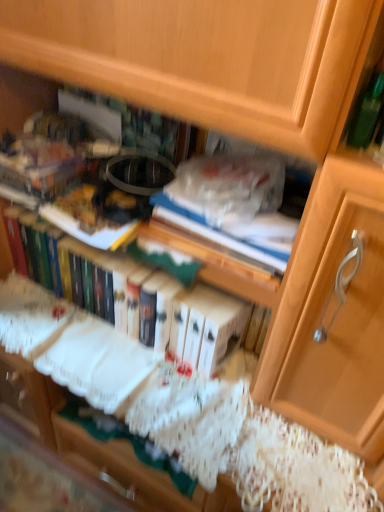
Question: From the image's perspective, is hardcover book at center positioned above or below blue hardcover book at center?

Choices:
 (A) above
 (B) below

Answer: (B)

Question: Is hardcover book at center spatially inside blue hardcover book at center, or outside of it?

Choices:
 (A) inside
 (B) outside

Answer: (B)

Question: Is hardcover book at center to the left or to the right of blue hardcover book at center in the image?

Choices:
 (A) right
 (B) left

Answer: (B)

Question: In terms of width, does blue hardcover book at center look wider or thinner when compared to hardcover book at center?

Choices:
 (A) wide
 (B) thin

Answer: (B)

Question: Is blue hardcover book at center inside the boundaries of hardcover book at center, or outside?

Choices:
 (A) inside
 (B) outside

Answer: (B)

Question: In the image, is blue hardcover book at center positioned in front of or behind hardcover book at center?

Choices:
 (A) behind
 (B) front

Answer: (B)

Question: From the image's perspective, is blue hardcover book at center located above or below hardcover book at center?

Choices:
 (A) below
 (B) above

Answer: (B)